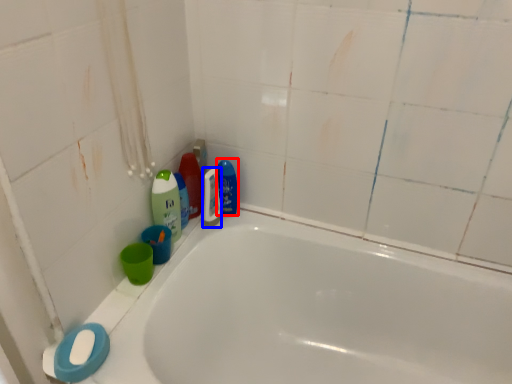
Question: Which point is further to the camera, cleaning product (highlighted by a red box) or mouthwash (highlighted by a blue box)?

Choices:
 (A) cleaning product
 (B) mouthwash

Answer: (A)